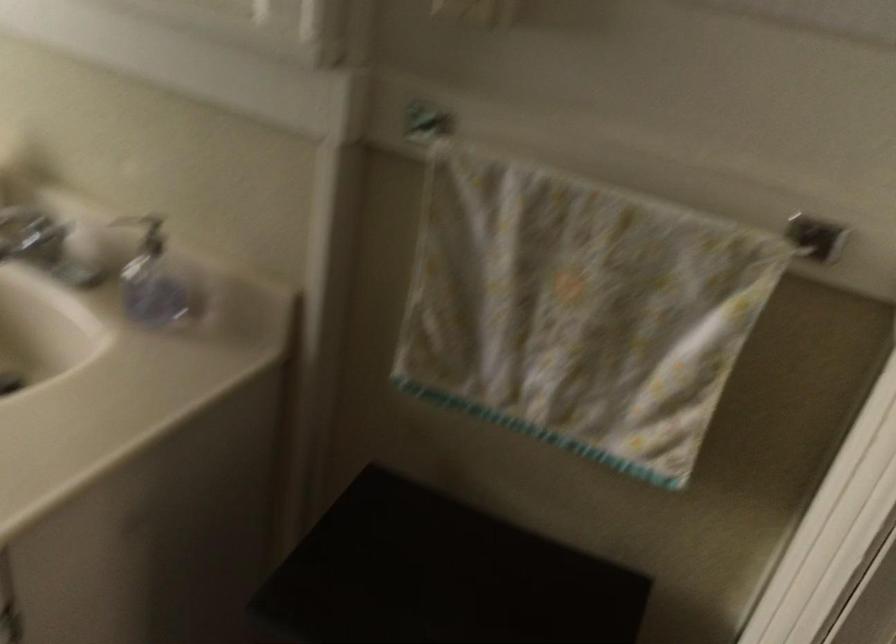
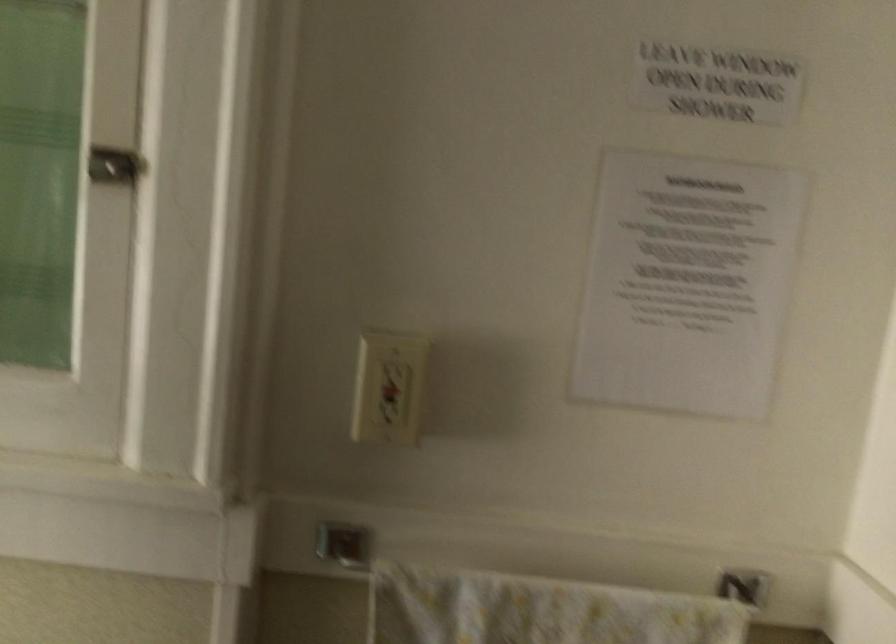
Question: The camera is either moving clockwise (left) or counter-clockwise (right) around the object. The first image is from the beginning of the video and the second image is from the end. Is the camera moving left or right when shooting the video?

Choices:
 (A) Left
 (B) Right

Answer: (A)